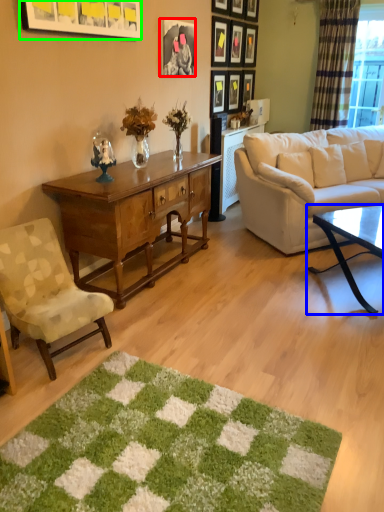
Question: Estimate the real-world distances between objects in this image. Which object is farther from picture frame (highlighted by a red box), coffee table (highlighted by a blue box) or picture frame (highlighted by a green box)?

Choices:
 (A) coffee table
 (B) picture frame

Answer: (A)